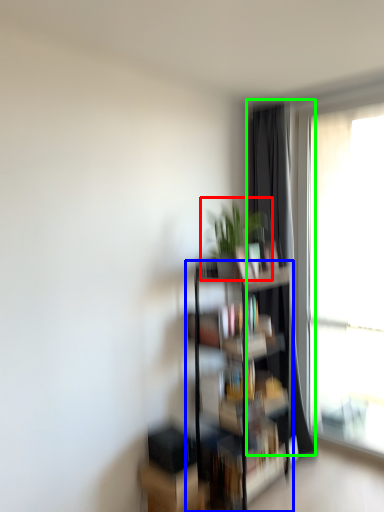
Question: Which is farther away from houseplant (highlighted by a red box)? shelf (highlighted by a blue box) or curtain (highlighted by a green box)?

Choices:
 (A) shelf
 (B) curtain

Answer: (A)